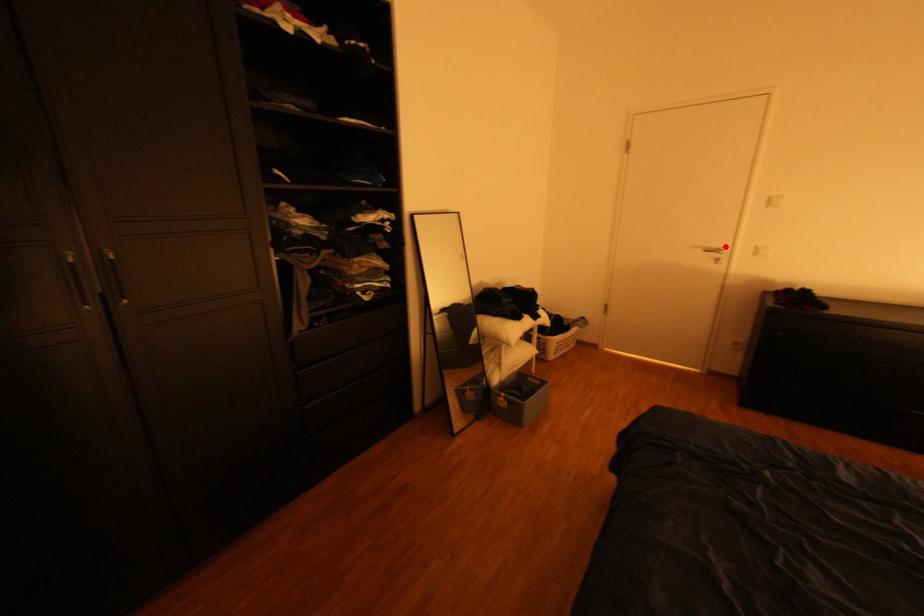
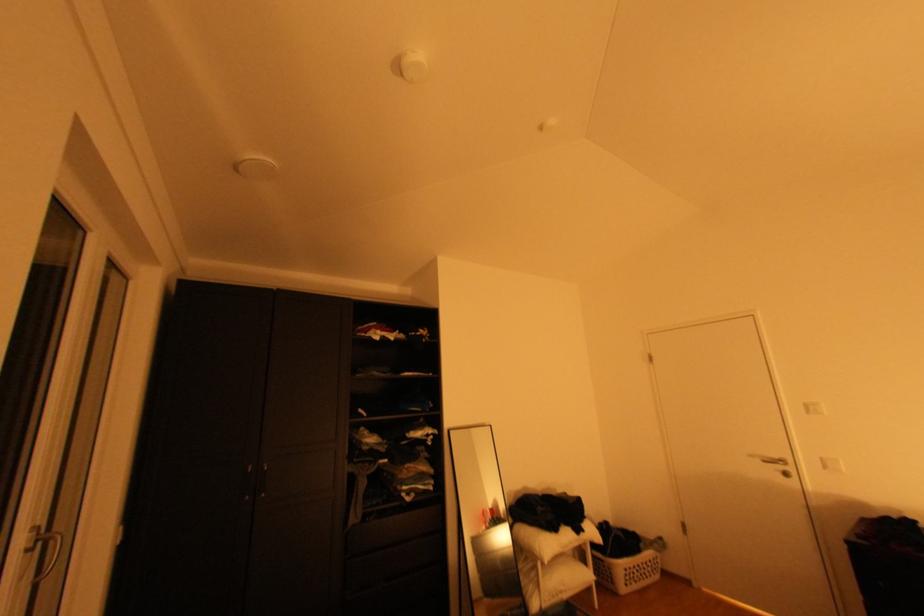
Where in the second image is the point corresponding to the highlighted location from the first image?

(786, 456)